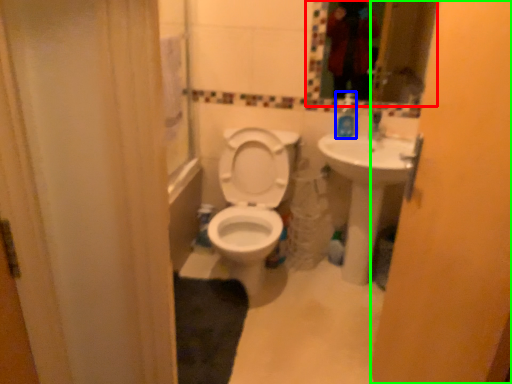
Question: Considering the real-world distances, which object is farthest from mirror (highlighted by a red box)? soap dispenser (highlighted by a blue box) or screen door (highlighted by a green box)?

Choices:
 (A) soap dispenser
 (B) screen door

Answer: (B)